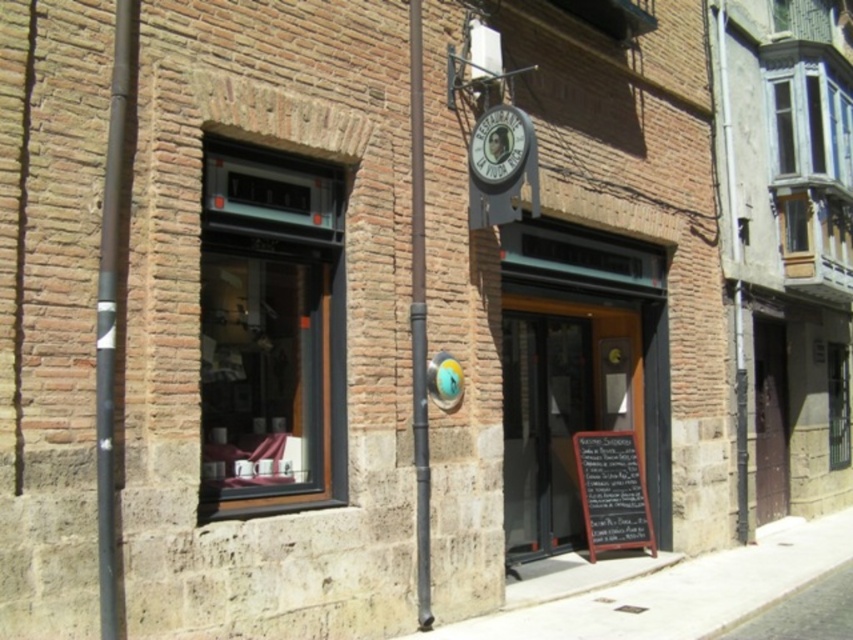
Is clear glass window at center bigger than smooth metal pole at center?

Indeed, clear glass window at center has a larger size compared to smooth metal pole at center.

Which is below, clear glass window at center or smooth metal pole at center?

clear glass window at center

Find the location of `clear glass window at center`. clear glass window at center is located at coordinates [270, 332].

The image size is (853, 640). I want to click on clear glass window at center, so click(x=270, y=332).

Can you confirm if wooden door at center is positioned above metallic signboard at upper center?

No.

Is wooden door at center below metallic signboard at upper center?

Correct, wooden door at center is located below metallic signboard at upper center.

Image resolution: width=853 pixels, height=640 pixels. What are the coordinates of `wooden door at center` in the screenshot? It's located at (578, 372).

Who is more distant from viewer, (848, 163) or (480, 136)?

The point (848, 163) is more distant.

Can you confirm if blue painted wood window at upper right is positioned to the right of metallic signboard at upper center?

Yes, blue painted wood window at upper right is to the right of metallic signboard at upper center.

Is point (798, 120) behind point (468, 152)?

Yes.

You are a GUI agent. You are given a task and a screenshot of the screen. Output one action in this format:
    pyautogui.click(x=<x>, y=<y>)
    Task: Click on the blue painted wood window at upper right
    
    Given the screenshot: What is the action you would take?
    pyautogui.click(x=810, y=124)